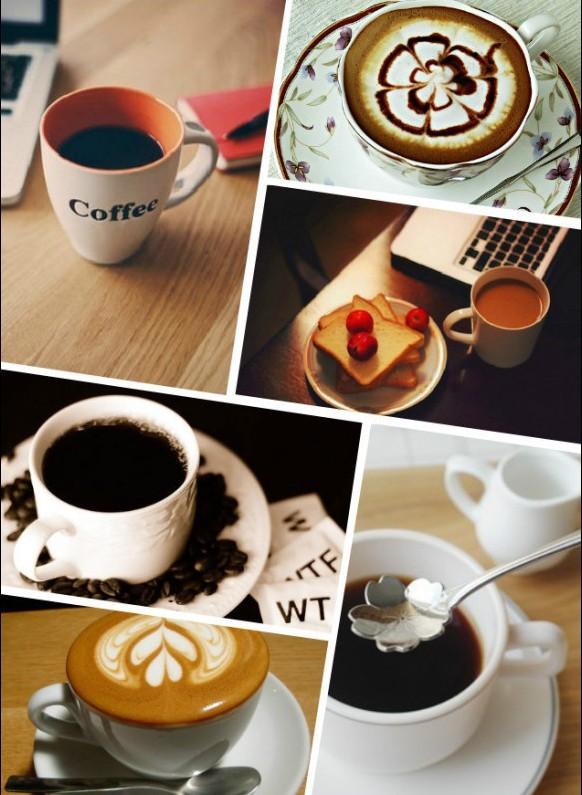
You are a GUI agent. You are given a task and a screenshot of the screen. Output one action in this format:
    pyautogui.click(x=<x>, y=<y>)
    Task: Click on the saucers
    
    Given the screenshot: What is the action you would take?
    pyautogui.click(x=287, y=722), pyautogui.click(x=425, y=785), pyautogui.click(x=247, y=560), pyautogui.click(x=346, y=169)